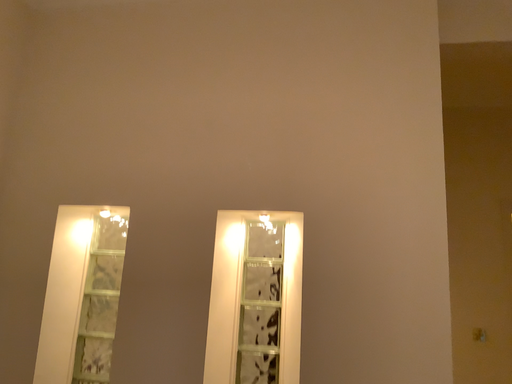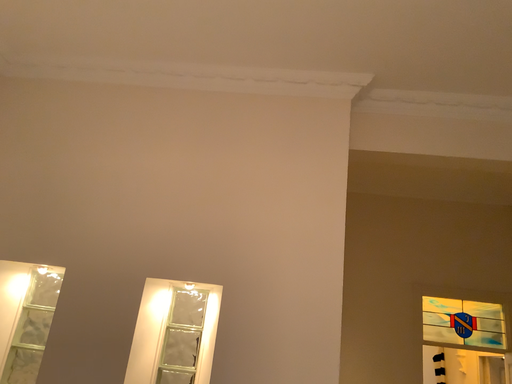
Question: Which way did the camera rotate in the video?

Choices:
 (A) rotated downward
 (B) rotated upward

Answer: (B)